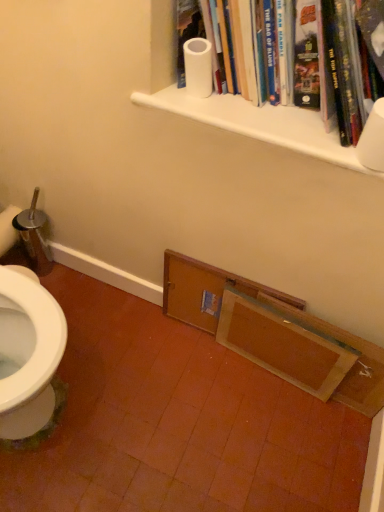
Question: Considering the relative sizes of white matte shelf at upper center, which is counted as the 2th shelf, starting from the back, and white matte paper towel roll at upper center in the image provided, is white matte shelf at upper center, which is counted as the 2th shelf, starting from the back, thinner than white matte paper towel roll at upper center?

Choices:
 (A) yes
 (B) no

Answer: (A)

Question: Is the depth of white matte shelf at upper center, which is counted as the first shelf, starting from the front, less than that of white matte paper towel roll at upper center?

Choices:
 (A) yes
 (B) no

Answer: (B)

Question: Can you confirm if white matte shelf at upper center, which is counted as the first shelf, starting from the front, is positioned to the right of white matte paper towel roll at upper center?

Choices:
 (A) no
 (B) yes

Answer: (A)

Question: Does white matte shelf at upper center, placed as the first shelf when sorted from top to bottom, touch white matte paper towel roll at upper center?

Choices:
 (A) no
 (B) yes

Answer: (B)

Question: From a real-world perspective, does white matte shelf at upper center, which is counted as the first shelf, starting from the front, stand above white matte paper towel roll at upper center?

Choices:
 (A) yes
 (B) no

Answer: (B)

Question: Does white matte shelf at upper center, placed as the first shelf when sorted from top to bottom, turn towards white matte paper towel roll at upper center?

Choices:
 (A) yes
 (B) no

Answer: (B)

Question: Considering the relative sizes of white matte toilet paper at upper right, the first toilet paper when ordered from front to back, and wooden frame at lower center in the image provided, is white matte toilet paper at upper right, the first toilet paper when ordered from front to back, wider than wooden frame at lower center?

Choices:
 (A) yes
 (B) no

Answer: (A)

Question: From a real-world perspective, is white matte toilet paper at upper right, the 2th toilet paper positioned from the back, on wooden frame at lower center?

Choices:
 (A) no
 (B) yes

Answer: (B)

Question: From a real-world perspective, is white matte toilet paper at upper right, which ranks as the second toilet paper in left-to-right order, positioned under wooden frame at lower center based on gravity?

Choices:
 (A) yes
 (B) no

Answer: (B)

Question: Considering the relative sizes of white matte toilet paper at upper right, the first toilet paper when ordered from front to back, and wooden frame at lower center in the image provided, is white matte toilet paper at upper right, the first toilet paper when ordered from front to back, shorter than wooden frame at lower center?

Choices:
 (A) yes
 (B) no

Answer: (A)

Question: Is there a large distance between white matte toilet paper at upper right, the first toilet paper when ordered from bottom to top, and wooden frame at lower center?

Choices:
 (A) no
 (B) yes

Answer: (A)

Question: From the image's perspective, is white matte toilet paper at upper right, which ranks as the second toilet paper in left-to-right order, located beneath wooden frame at lower center?

Choices:
 (A) no
 (B) yes

Answer: (A)

Question: Would you say white matte shelf at upper center, arranged as the second shelf when ordered from the bottom, is outside white matte toilet paper at upper right, which ranks as the second toilet paper in left-to-right order?

Choices:
 (A) no
 (B) yes

Answer: (B)